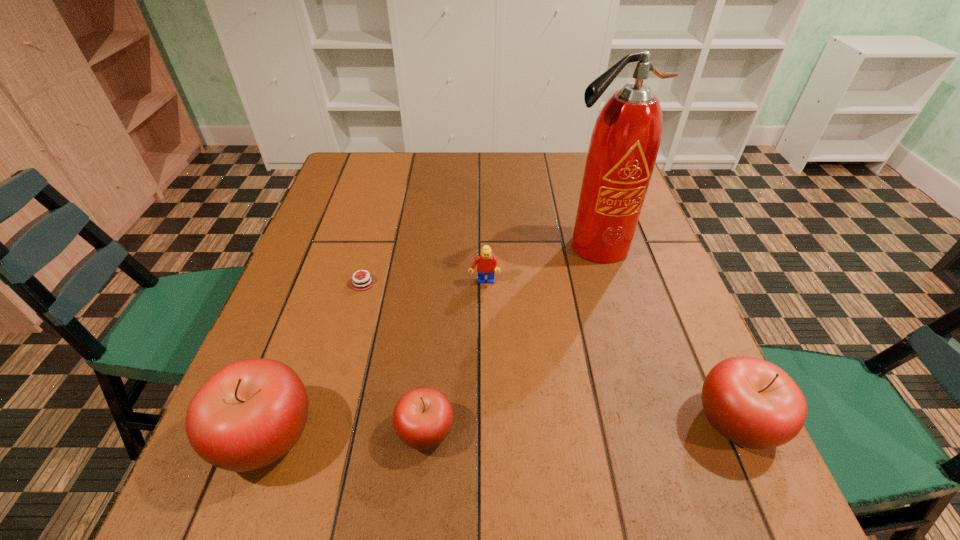
This screenshot has width=960, height=540. I want to click on free location that satisfies the following two spatial constraints: 1. on the back side of the tallest object; 2. on the right side of the chocolate cake, so click(372, 246).